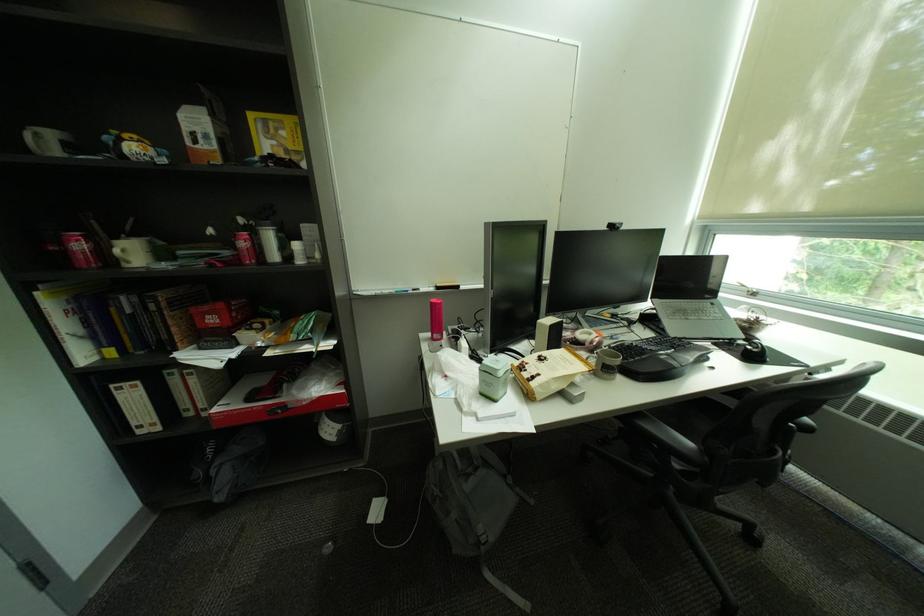
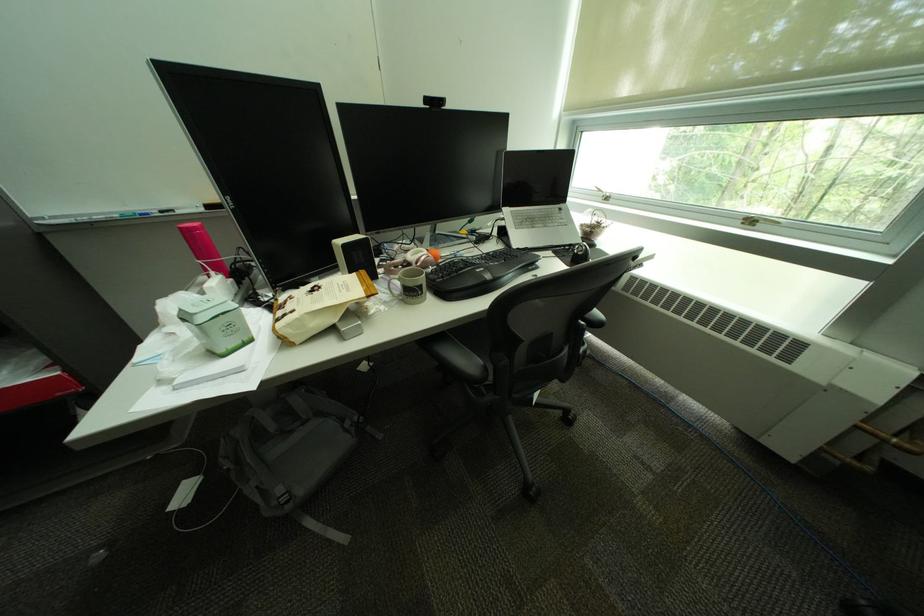
Question: Based on the continuous images, in which direction is the camera rotating? Reply with the corresponding letter.

Choices:
 (A) Left
 (B) Right
 (C) Up
 (D) Down

Answer: (D)